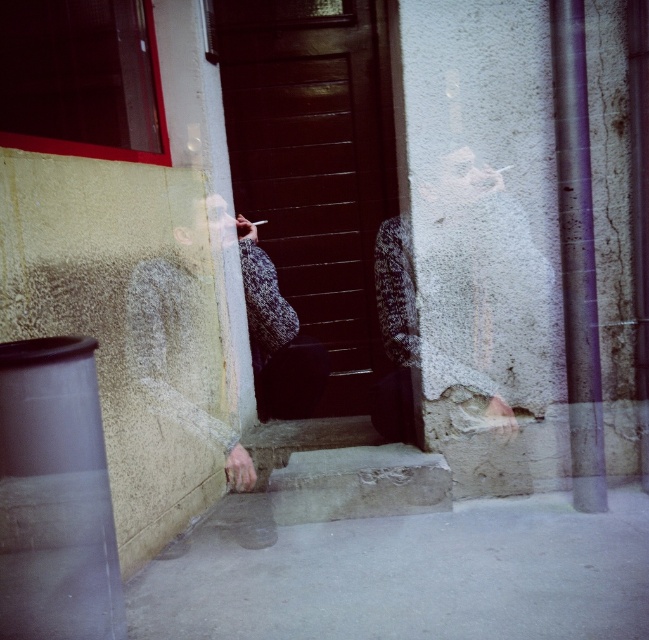
Which is in front, point (288, 388) or point (262, 225)?

Point (262, 225)

Does point (265, 340) lie behind point (262, 225)?

No, (265, 340) is closer to viewer.

The image size is (649, 640). What do you see at coordinates (276, 339) in the screenshot?
I see `knitted sweater at center` at bounding box center [276, 339].

Identify the location of knitted sweater at center. The image size is (649, 640). (276, 339).

Can you confirm if concrete textured stair at center is positioned to the right of knitted sweater at center?

Indeed, concrete textured stair at center is positioned on the right side of knitted sweater at center.

Does concrete textured stair at center appear on the left side of knitted sweater at center?

Incorrect, concrete textured stair at center is not on the left side of knitted sweater at center.

Between point (386, 508) and point (275, 404), which one is positioned behind?

The point (275, 404) is more distant.

Locate an element on the screen. The height and width of the screenshot is (640, 649). concrete textured stair at center is located at coordinates (343, 472).

Who is positioned more to the right, dark wood door at center or knitted sweater at center?

Positioned to the right is dark wood door at center.

Between dark wood door at center and knitted sweater at center, which one appears on the left side from the viewer's perspective?

Positioned to the left is knitted sweater at center.

Is point (376, 368) positioned behind point (269, 320)?

Yes, point (376, 368) is farther from viewer.

Where is `dark wood door at center`? This screenshot has height=640, width=649. dark wood door at center is located at coordinates (315, 164).